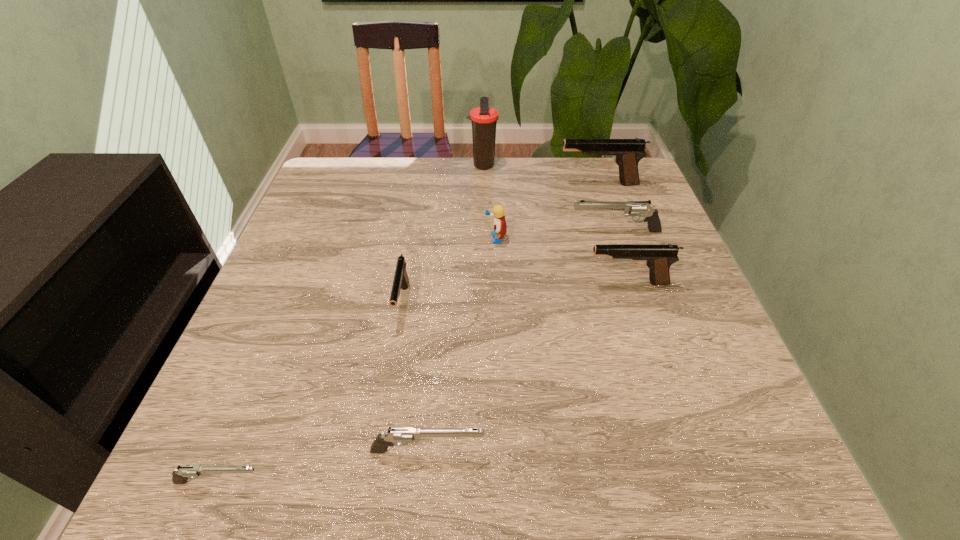
The image size is (960, 540). Find the location of `vacant space located 0.110m on the front-facing side of the Lego`. vacant space located 0.110m on the front-facing side of the Lego is located at coordinates (440, 239).

Where is `free spot located on the front-facing side of the Lego`? free spot located on the front-facing side of the Lego is located at coordinates (422, 239).

You are a GUI agent. You are given a task and a screenshot of the screen. Output one action in this format:
    pyautogui.click(x=<x>, y=<y>)
    Task: Click on the free space located on the front-facing side of the Lego
    This screenshot has height=540, width=960.
    Given the screenshot: What is the action you would take?
    pyautogui.click(x=386, y=239)

Identify the location of vacant space situated 0.050m on the front-facing side of the second farthest pistol. This screenshot has width=960, height=540. (549, 231).

Locate an element on the screen. The image size is (960, 540). vacant space located 0.300m on the front-facing side of the second farthest pistol is located at coordinates (448, 231).

At what (x,y) coordinates should I click in order to perform the action: click on vacant space located on the front-facing side of the second farthest pistol. Please return your answer as a coordinate pair (x, y). Looking at the image, I should click on point(468,231).

The width and height of the screenshot is (960, 540). I want to click on blank space located at the muzzle of the smallest black pistol, so click(378, 447).

I want to click on free space located on the front-facing side of the second biggest silver pistol, so click(660, 451).

What are the coordinates of `free space located on the front-facing side of the nearest object` in the screenshot? It's located at (496, 482).

At what (x,y) coordinates should I click in order to perform the action: click on thermos bottle situated at the far edge. Please return your answer as a coordinate pair (x, y). This screenshot has height=540, width=960. Looking at the image, I should click on (484, 118).